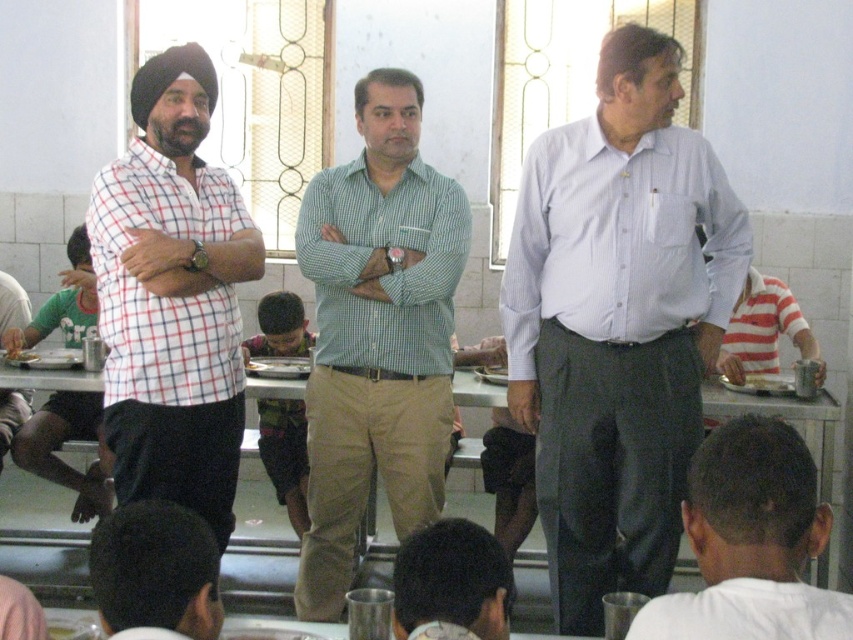
Does green checkered shirt at center have a greater height compared to white matte shirt at center?

Indeed, green checkered shirt at center has a greater height compared to white matte shirt at center.

Is green checkered shirt at center shorter than white matte shirt at center?

No.

Locate an element on the screen. The height and width of the screenshot is (640, 853). green checkered shirt at center is located at coordinates pyautogui.click(x=376, y=333).

In order to click on green checkered shirt at center in this screenshot , I will do `click(376, 333)`.

Between green checkered shirt at center and checkered fabric shirt at left, which one is positioned higher?

checkered fabric shirt at left is higher up.

Who is shorter, green checkered shirt at center or checkered fabric shirt at left?

checkered fabric shirt at left

Is point (380, 140) positioned behind point (193, 51)?

Yes, point (380, 140) is behind point (193, 51).

Image resolution: width=853 pixels, height=640 pixels. Find the location of `green checkered shirt at center`. green checkered shirt at center is located at coordinates (376, 333).

From the picture: Can you confirm if matte plaid shirt at left is taller than matte silver plate at center?

Correct, matte plaid shirt at left is much taller as matte silver plate at center.

Who is shorter, matte plaid shirt at left or matte silver plate at center?

Standing shorter between the two is matte silver plate at center.

Between point (71, 314) and point (27, 360), which one is positioned behind?

The point (71, 314) is behind.

Where is `matte plaid shirt at left`? The width and height of the screenshot is (853, 640). matte plaid shirt at left is located at coordinates (59, 448).